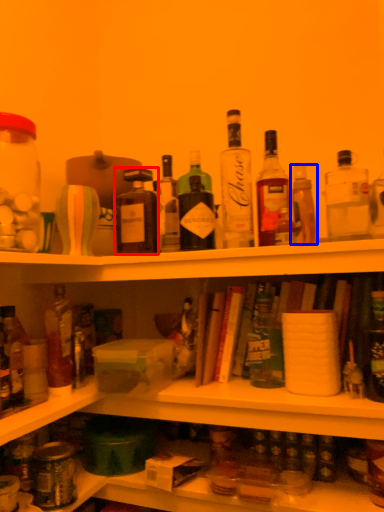
Question: Among these objects, which one is nearest to the camera, bottle (highlighted by a red box) or bottle (highlighted by a blue box)?

Choices:
 (A) bottle
 (B) bottle

Answer: (B)